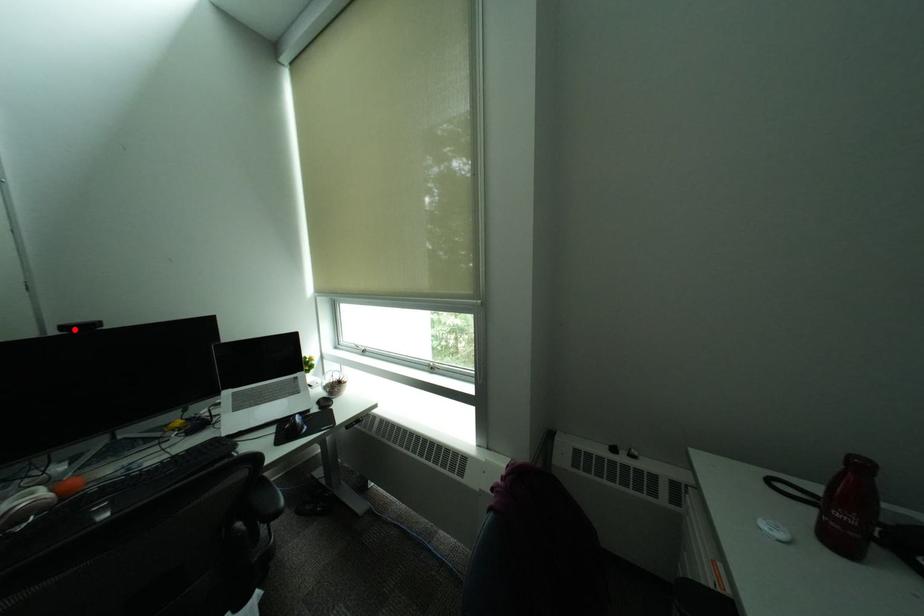
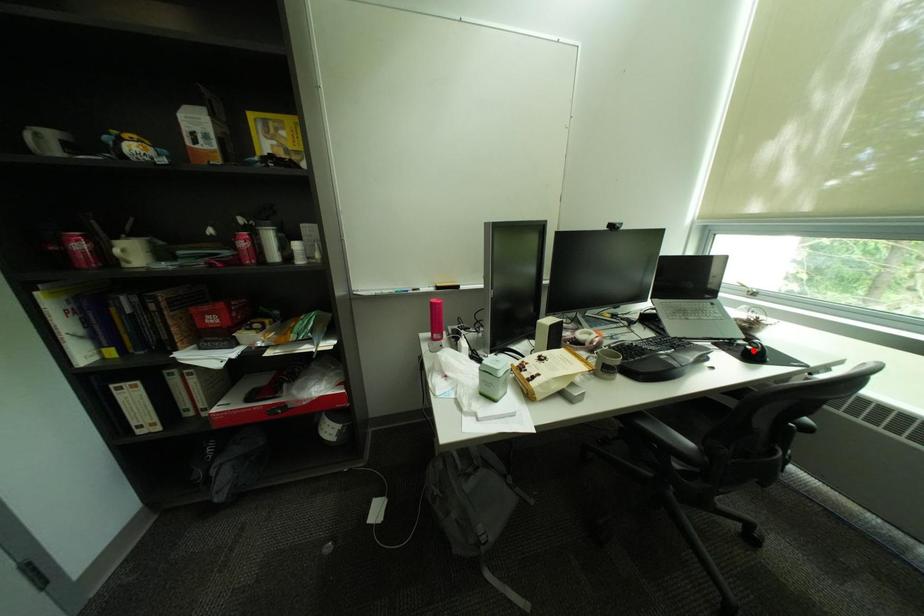
I am providing you with two images of the same scene from different viewpoints. A red point is marked on the first image and another point is marked on the second image. Is the red point in image1 aligned with the point shown in image2?

No